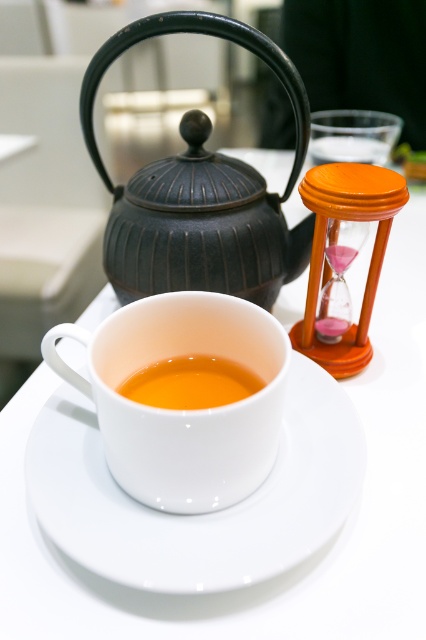
Measure the distance from matte black teapot at upper left to white glossy teacup at center.

The distance of matte black teapot at upper left from white glossy teacup at center is 17.40 centimeters.

Which is more to the right, matte black teapot at upper left or white glossy teacup at center?

matte black teapot at upper left

The width and height of the screenshot is (426, 640). What do you see at coordinates (199, 189) in the screenshot?
I see `matte black teapot at upper left` at bounding box center [199, 189].

Where is `matte black teapot at upper left`? This screenshot has width=426, height=640. matte black teapot at upper left is located at coordinates (199, 189).

Consider the image. Can you confirm if white glossy saucer at center is taller than white glossy teacup at center?

Incorrect, white glossy saucer at center's height is not larger of white glossy teacup at center's.

Image resolution: width=426 pixels, height=640 pixels. I want to click on white glossy saucer at center, so pyautogui.click(x=204, y=513).

The height and width of the screenshot is (640, 426). In order to click on white glossy saucer at center in this screenshot , I will do `click(204, 513)`.

Which is more to the right, white glossy saucer at center or matte black teapot at upper left?

From the viewer's perspective, white glossy saucer at center appears more on the right side.

Does point (328, 520) come closer to viewer compared to point (198, 170)?

Yes, it is in front of point (198, 170).

Which is in front, point (330, 380) or point (299, 124)?

Point (330, 380) is more forward.

The width and height of the screenshot is (426, 640). Identify the location of white glossy saucer at center. (204, 513).